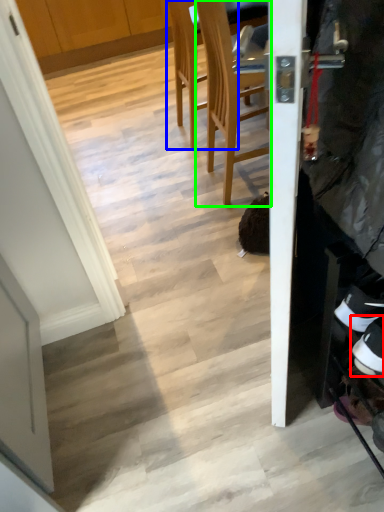
Question: Which object is positioned closest to footwear (highlighted by a red box)? Select from chair (highlighted by a blue box) and chair (highlighted by a green box).

Choices:
 (A) chair
 (B) chair

Answer: (B)